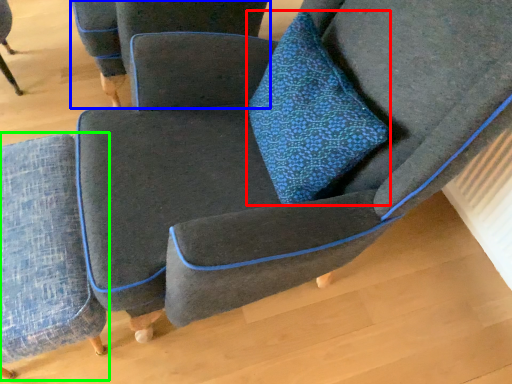
Question: Which object is positioned farthest from throw pillow (highlighted by a red box)? Select from chair (highlighted by a blue box) and chair (highlighted by a green box).

Choices:
 (A) chair
 (B) chair

Answer: (A)